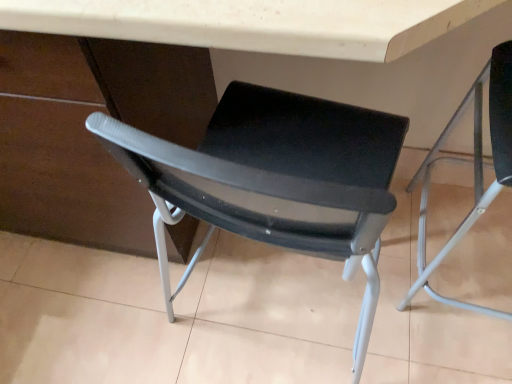
Question: Is black mesh chair at center, which appears as the 1th chair when viewed from the left, positioned far away from matte black chair at right, acting as the 2th chair starting from the left?

Choices:
 (A) no
 (B) yes

Answer: (A)

Question: From a real-world perspective, is black mesh chair at center, which appears as the 1th chair when viewed from the left, physically below matte black chair at right, acting as the 2th chair starting from the left?

Choices:
 (A) yes
 (B) no

Answer: (A)

Question: Could matte black chair at right, acting as the 2th chair starting from the left, be considered to be inside black mesh chair at center, marked as the second chair in a right-to-left arrangement?

Choices:
 (A) no
 (B) yes

Answer: (A)

Question: Considering the relative sizes of black mesh chair at center, which appears as the 1th chair when viewed from the left, and matte black chair at right, acting as the 2th chair starting from the left, in the image provided, is black mesh chair at center, which appears as the 1th chair when viewed from the left, wider than matte black chair at right, acting as the 2th chair starting from the left,?

Choices:
 (A) yes
 (B) no

Answer: (A)

Question: Does black mesh chair at center, which appears as the 1th chair when viewed from the left, have a lesser width compared to matte black chair at right, the first chair when ordered from right to left?

Choices:
 (A) no
 (B) yes

Answer: (A)

Question: Considering the positions of black mesh chair at center, which appears as the 1th chair when viewed from the left, and matte black chair at right, acting as the 2th chair starting from the left, in the image, is black mesh chair at center, which appears as the 1th chair when viewed from the left, taller or shorter than matte black chair at right, acting as the 2th chair starting from the left,?

Choices:
 (A) tall
 (B) short

Answer: (B)

Question: Would you say black mesh chair at center, which appears as the 1th chair when viewed from the left, is inside or outside matte black chair at right, the first chair when ordered from right to left?

Choices:
 (A) outside
 (B) inside

Answer: (A)

Question: Based on their sizes in the image, would you say black mesh chair at center, marked as the second chair in a right-to-left arrangement, is bigger or smaller than matte black chair at right, acting as the 2th chair starting from the left?

Choices:
 (A) big
 (B) small

Answer: (B)

Question: Looking at their shapes, would you say black mesh chair at center, which appears as the 1th chair when viewed from the left, is wider or thinner than matte black chair at right, acting as the 2th chair starting from the left?

Choices:
 (A) thin
 (B) wide

Answer: (B)

Question: Is matte plastic table at center in front of or behind matte black chair at right, acting as the 2th chair starting from the left, in the image?

Choices:
 (A) behind
 (B) front

Answer: (B)

Question: Looking at the image, does matte plastic table at center seem bigger or smaller compared to matte black chair at right, the first chair when ordered from right to left?

Choices:
 (A) big
 (B) small

Answer: (A)

Question: From the image's perspective, is matte plastic table at center above or below matte black chair at right, acting as the 2th chair starting from the left?

Choices:
 (A) below
 (B) above

Answer: (B)

Question: Is matte plastic table at center taller or shorter than matte black chair at right, the first chair when ordered from right to left?

Choices:
 (A) tall
 (B) short

Answer: (A)

Question: Is point (185, 193) positioned closer to the camera than point (79, 96)?

Choices:
 (A) farther
 (B) closer

Answer: (B)

Question: Considering their positions, is black mesh chair at center, marked as the second chair in a right-to-left arrangement, located in front of or behind matte plastic table at center?

Choices:
 (A) behind
 (B) front

Answer: (A)